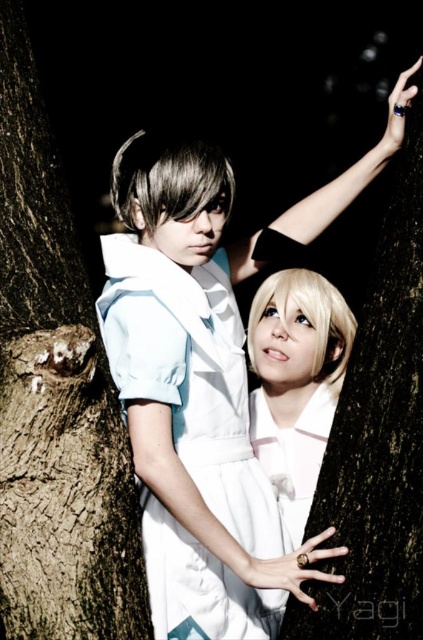
Question: Which point is farther to the camera?

Choices:
 (A) (52, 620)
 (B) (178, 387)

Answer: (B)

Question: Is brown rough tree trunk at left below white satin dress at center?

Choices:
 (A) yes
 (B) no

Answer: (B)

Question: Where is brown rough tree trunk at left located in relation to white satin dress at center in the image?

Choices:
 (A) below
 (B) above

Answer: (B)

Question: Among these points, which one is nearest to the camera?

Choices:
 (A) (216, 376)
 (B) (58, 465)

Answer: (B)

Question: Is the position of brown rough tree trunk at left less distant than that of white satin dress at center?

Choices:
 (A) no
 (B) yes

Answer: (B)